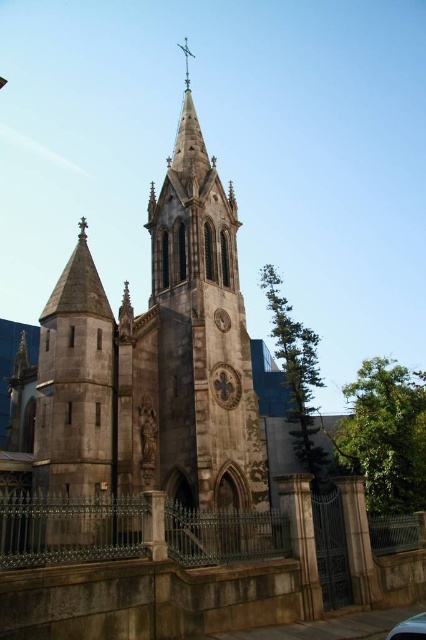
Can you confirm if stone steeple at center is wider than metallic silver car at lower right?

Yes.

This screenshot has width=426, height=640. Identify the location of stone steeple at center. (192, 362).

At what (x,y) coordinates should I click in order to perform the action: click on stone steeple at center. Please return your answer as a coordinate pair (x, y). Looking at the image, I should click on (192, 362).